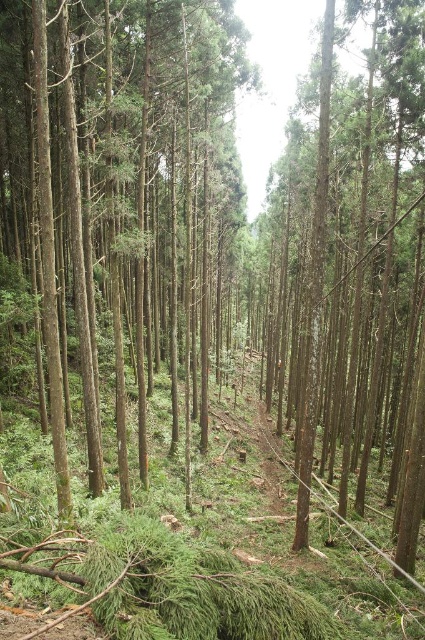
Question: Which point is farther to the camera?

Choices:
 (A) (345, 128)
 (B) (40, 76)

Answer: (A)

Question: Among these objects, which one is nearest to the camera?

Choices:
 (A) green smooth tree at center
 (B) smooth brown tree trunk at center

Answer: (B)

Question: Can you confirm if green smooth tree at center is smaller than smooth brown tree trunk at center?

Choices:
 (A) yes
 (B) no

Answer: (A)

Question: From the image, what is the correct spatial relationship of green smooth tree at center in relation to smooth brown tree trunk at center?

Choices:
 (A) left
 (B) right

Answer: (A)

Question: Is the position of green smooth tree at center less distant than that of smooth brown tree trunk at center?

Choices:
 (A) yes
 (B) no

Answer: (B)